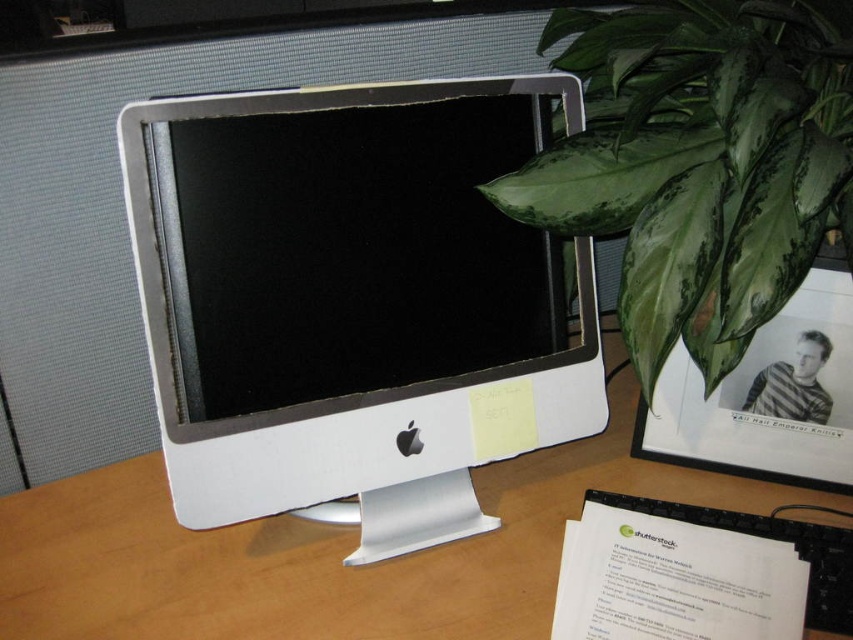
You are organizing items on your desk and need to place a new item between the white plastic desktop computer at center and the green glossy leaf at upper right. Which object should you place the item closer to if you want it to be closer to you?

You should place the item closer to the white plastic desktop computer at center because it is already closer to you than the green glossy leaf at upper right.

You are setting up a new router and need to place it between the white plastic desktop computer at center and the white plastic computer monitor at center. The router requires 12 inches of space to function properly. Based on the image, will the available space between them be sufficient for the router?

The white plastic desktop computer at center and white plastic computer monitor at center are 11.09 inches apart, which is less than the required 12 inches. Therefore, the available space is insufficient for the router to function properly.